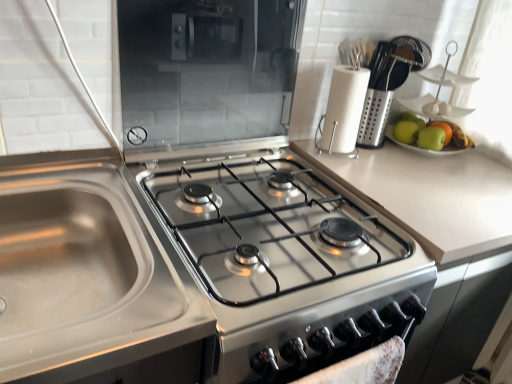
Where is `free space in front of green matte apple at right, which is counted as the first apple, starting from the right`? This screenshot has height=384, width=512. free space in front of green matte apple at right, which is counted as the first apple, starting from the right is located at coordinates (461, 167).